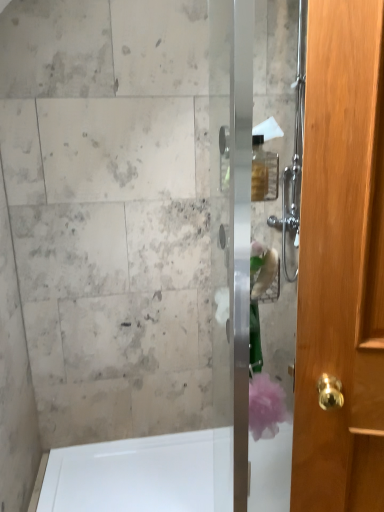
Where is `white glossy bathtub at lower left`? white glossy bathtub at lower left is located at coordinates coord(143,474).

What do you see at coordinates (143, 474) in the screenshot? The image size is (384, 512). I see `white glossy bathtub at lower left` at bounding box center [143, 474].

Describe the element at coordinates (261, 244) in the screenshot. The image size is (384, 512). I see `clear glass shower door at center` at that location.

The height and width of the screenshot is (512, 384). Identify the location of clear glass shower door at center. (261, 244).

Locate an element on the screen. The image size is (384, 512). white glossy bathtub at lower left is located at coordinates (143, 474).

In the image, is white glossy bathtub at lower left on the left side or the right side of clear glass shower door at center?

white glossy bathtub at lower left is positioned on clear glass shower door at center's left side.

Does white glossy bathtub at lower left lie behind clear glass shower door at center?

Yes.

Does point (71, 448) appear closer or farther from the camera than point (241, 290)?

Clearly, point (71, 448) is more distant from the camera than point (241, 290).

From the image's perspective, which one is positioned lower, white glossy bathtub at lower left or clear glass shower door at center?

white glossy bathtub at lower left appears lower in the image.

Looking at this image, from a real-world perspective, relative to clear glass shower door at center, is white glossy bathtub at lower left vertically above or below?

Clearly, from a real-world perspective, white glossy bathtub at lower left is below clear glass shower door at center.

Does white glossy bathtub at lower left have a lesser width compared to clear glass shower door at center?

In fact, white glossy bathtub at lower left might be wider than clear glass shower door at center.

Considering the sizes of objects white glossy bathtub at lower left and clear glass shower door at center in the image provided, who is shorter, white glossy bathtub at lower left or clear glass shower door at center?

With less height is white glossy bathtub at lower left.

Is white glossy bathtub at lower left bigger than clear glass shower door at center?

Yes.

Is clear glass shower door at center located within white glossy bathtub at lower left?

No, white glossy bathtub at lower left does not contain clear glass shower door at center.

Is white glossy bathtub at lower left touching clear glass shower door at center?

There is a gap between white glossy bathtub at lower left and clear glass shower door at center.

Is white glossy bathtub at lower left facing towards clear glass shower door at center?

No, white glossy bathtub at lower left is not turned towards clear glass shower door at center.

How many degrees apart are the facing directions of white glossy bathtub at lower left and clear glass shower door at center?

The angular difference between white glossy bathtub at lower left and clear glass shower door at center is 0.472 degrees.

Where is `bath on the left of clear glass shower door at center`? This screenshot has height=512, width=384. bath on the left of clear glass shower door at center is located at coordinates (143, 474).

Between clear glass shower door at center and white glossy bathtub at lower left, which one appears on the left side from the viewer's perspective?

From the viewer's perspective, white glossy bathtub at lower left appears more on the left side.

In the scene shown: Does clear glass shower door at center lie in front of white glossy bathtub at lower left?

Yes, clear glass shower door at center is in front of white glossy bathtub at lower left.

Is point (244, 384) behind point (62, 482)?

No, (244, 384) is in front of (62, 482).

From the image's perspective, which is above, clear glass shower door at center or white glossy bathtub at lower left?

clear glass shower door at center appears higher in the image.

From a real-world perspective, relative to white glossy bathtub at lower left, is clear glass shower door at center vertically above or below?

Clearly, from a real-world perspective, clear glass shower door at center is above white glossy bathtub at lower left.

Is clear glass shower door at center wider or thinner than white glossy bathtub at lower left?

In the image, clear glass shower door at center appears to be more narrow than white glossy bathtub at lower left.

Is clear glass shower door at center taller than white glossy bathtub at lower left?

Correct, clear glass shower door at center is much taller as white glossy bathtub at lower left.

Between clear glass shower door at center and white glossy bathtub at lower left, which one has smaller size?

Smaller between the two is clear glass shower door at center.

Would you say clear glass shower door at center is inside or outside white glossy bathtub at lower left?

clear glass shower door at center cannot be found inside white glossy bathtub at lower left.

Is the surface of clear glass shower door at center in direct contact with white glossy bathtub at lower left?

There is a gap between clear glass shower door at center and white glossy bathtub at lower left.

Is clear glass shower door at center turned away from white glossy bathtub at lower left?

No, clear glass shower door at center is not facing away from white glossy bathtub at lower left.

At what (x,y) coordinates should I click in order to perform the action: click on bath below the clear glass shower door at center (from the image's perspective). Please return your answer as a coordinate pair (x, y). The width and height of the screenshot is (384, 512). Looking at the image, I should click on (x=143, y=474).

Find the location of a particular element. screen door in front of the white glossy bathtub at lower left is located at coordinates (261, 244).

Image resolution: width=384 pixels, height=512 pixels. Identify the location of bath below the clear glass shower door at center (from the image's perspective). (143, 474).